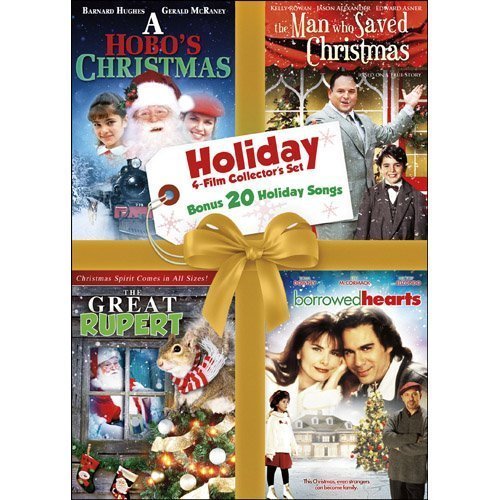
Find the location of a particular element. ornaments is located at coordinates (156, 466), (166, 425), (223, 453), (190, 485).